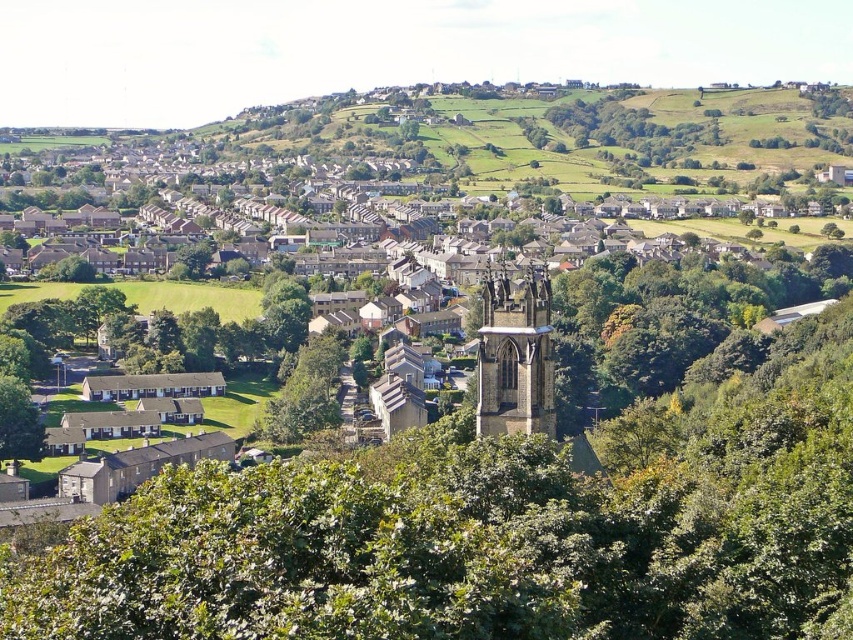
Is point (805, 451) positioned behind point (508, 307)?

No, it is not.

Who is more forward, [68,593] or [537,320]?

Positioned in front is point [68,593].

Locate an element on the screen. green leafy tree at center is located at coordinates (492, 518).

Is green leafy tree at center to the right of green leafy trees at upper right from the viewer's perspective?

No, green leafy tree at center is not to the right of green leafy trees at upper right.

Who is taller, green leafy tree at center or green leafy trees at upper right?

With more height is green leafy tree at center.

The width and height of the screenshot is (853, 640). Identify the location of green leafy tree at center. (492, 518).

Who is positioned more to the left, dark gray stone tower at center or green leafy trees at upper right?

dark gray stone tower at center is more to the left.

Is point (549, 394) closer to viewer compared to point (614, 109)?

That is True.

Locate an element on the screen. Image resolution: width=853 pixels, height=640 pixels. dark gray stone tower at center is located at coordinates (515, 356).